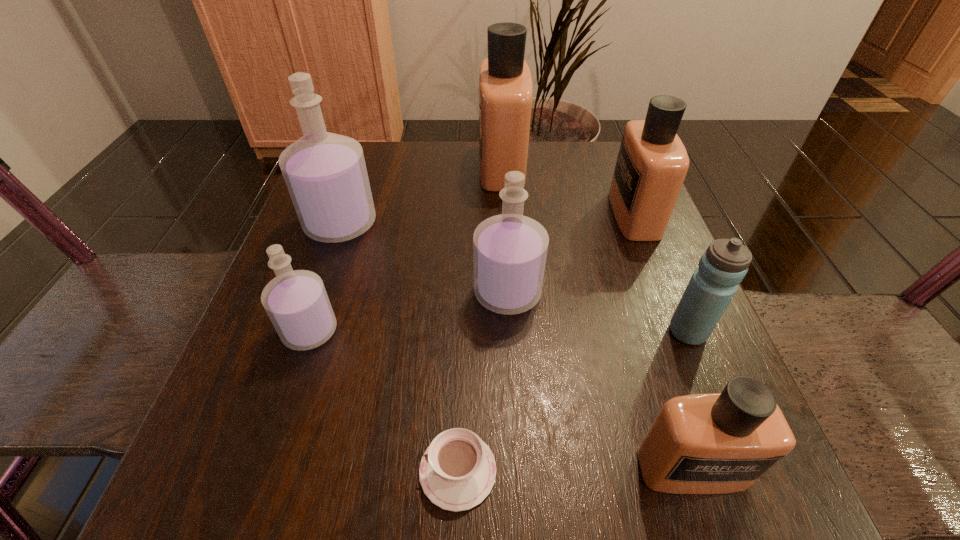
Find the location of `free space located on the front label of the biggest beige perfume`. free space located on the front label of the biggest beige perfume is located at coordinates (441, 166).

Locate an element on the screen. vacant space situated on the front label of the biggest beige perfume is located at coordinates (357, 166).

Locate an element on the screen. The width and height of the screenshot is (960, 540). vacant space located 0.380m on the front of the biggest purple perfume is located at coordinates (266, 442).

What are the coordinates of `vacant space positioned on the right of the second biggest purple perfume` in the screenshot? It's located at pyautogui.click(x=627, y=293).

You are a GUI agent. You are given a task and a screenshot of the screen. Output one action in this format:
    pyautogui.click(x=<x>, y=<y>)
    Task: Click on the vacant region located on the front label of the second biggest beige perfume
    
    Given the screenshot: What is the action you would take?
    pyautogui.click(x=489, y=214)

At what (x,y) coordinates should I click in order to perform the action: click on vacant area situated on the front label of the second biggest beige perfume. Please return your answer as a coordinate pair (x, y). Looking at the image, I should click on (469, 214).

You are a GUI agent. You are given a task and a screenshot of the screen. Output one action in this format:
    pyautogui.click(x=<x>, y=<y>)
    Task: Click on the free spot located 0.070m on the front label of the second biggest beige perfume
    Image resolution: width=960 pixels, height=540 pixels.
    Given the screenshot: What is the action you would take?
    pyautogui.click(x=580, y=214)

Locate an element on the screen. Image resolution: width=960 pixels, height=540 pixels. free location located on the front of the water bottle is located at coordinates (748, 481).

Locate an element on the screen. The image size is (960, 540). free region located 0.050m on the right of the smallest purple perfume is located at coordinates (368, 331).

Find the location of a particular element. free space located 0.180m on the handle side of the teacup is located at coordinates (276, 471).